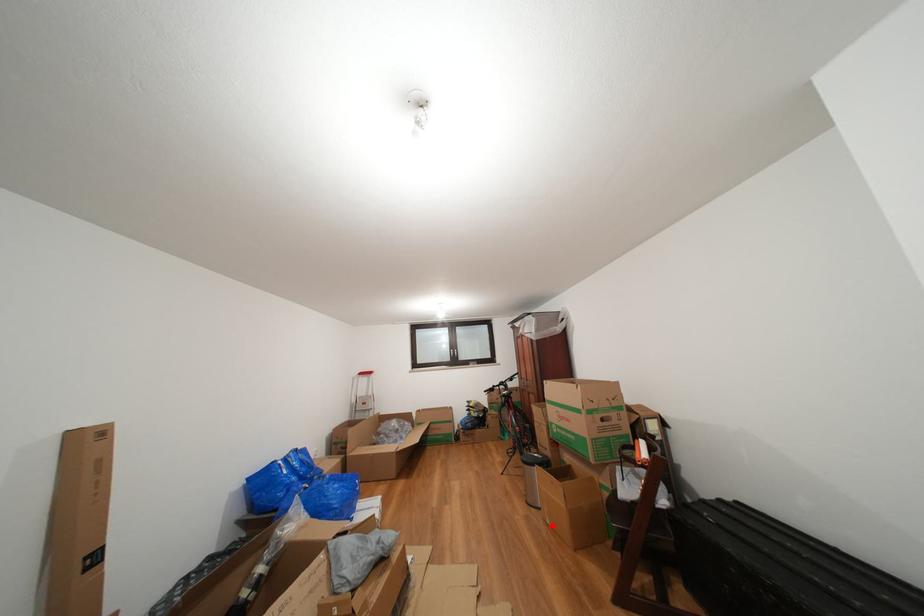
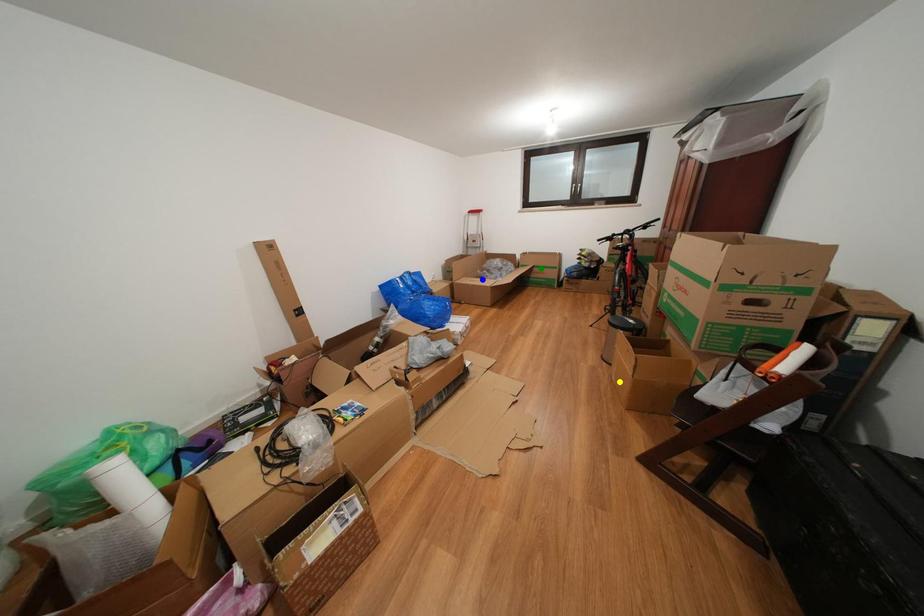
Question: I am providing you with two images of the same scene from different viewpoints. A red point is marked on the first image. You are given multiple points on the second image. Which point in image 2 represents the same 3d spot as the red point in image 1?

Choices:
 (A) yellow point
 (B) green point
 (C) blue point

Answer: (A)